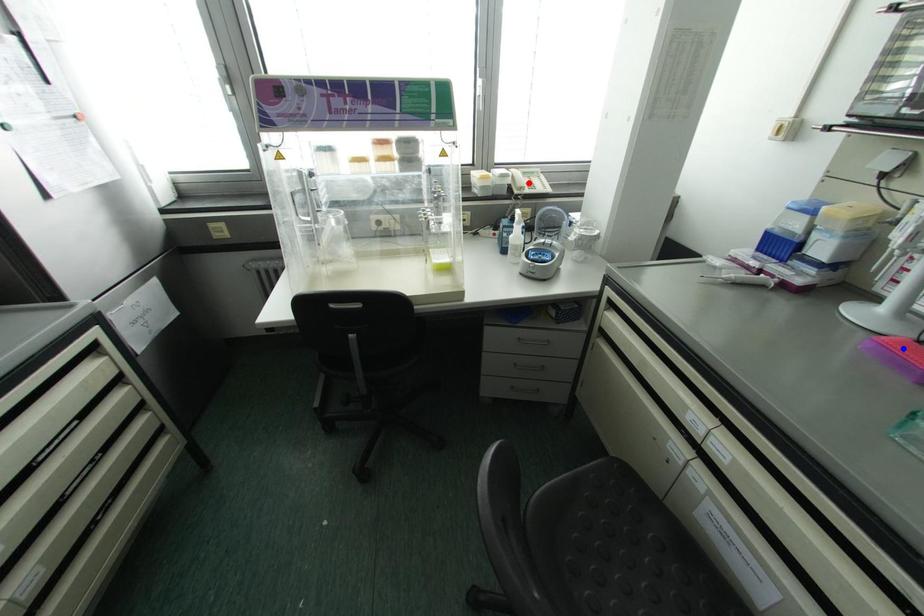
Question: Which of the two points in the image is closer to the camera?

Choices:
 (A) Blue point is closer.
 (B) Red point is closer.

Answer: (A)